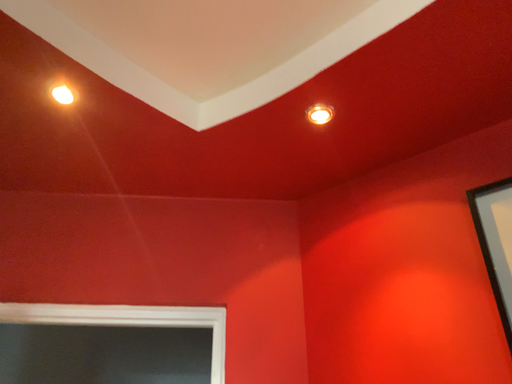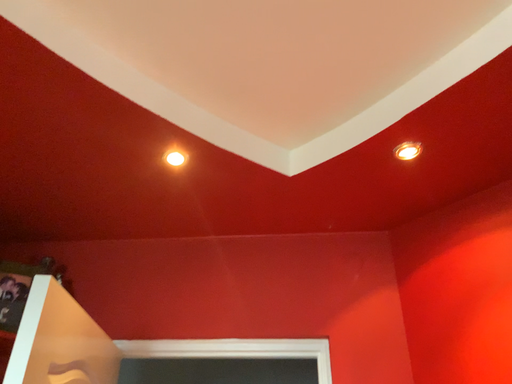
Question: How did the camera likely rotate when shooting the video?

Choices:
 (A) rotated left
 (B) rotated right

Answer: (A)